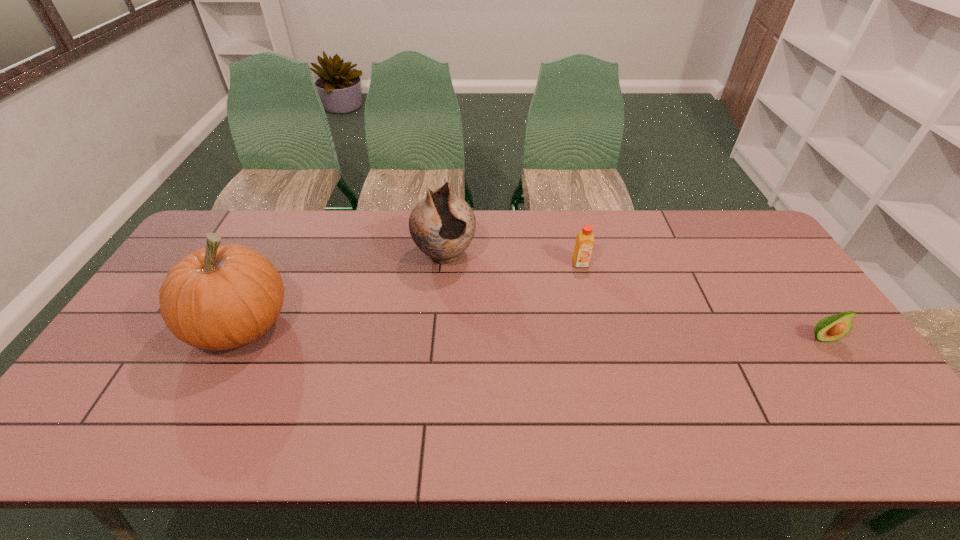
Where is `free spot located 0.260m on the front and back of the second shortest object`? The height and width of the screenshot is (540, 960). free spot located 0.260m on the front and back of the second shortest object is located at coordinates (601, 333).

The image size is (960, 540). In order to click on vacant space located 0.220m from the spout of the third object from right to left in this screenshot , I will do `click(482, 326)`.

The width and height of the screenshot is (960, 540). Find the location of `free spot located 0.220m from the spout of the third object from right to left`. free spot located 0.220m from the spout of the third object from right to left is located at coordinates (482, 326).

You are a GUI agent. You are given a task and a screenshot of the screen. Output one action in this format:
    pyautogui.click(x=<x>, y=<y>)
    Task: Click on the vacant point located 0.240m from the spout of the third object from right to left
    
    Given the screenshot: What is the action you would take?
    pyautogui.click(x=485, y=330)

At what (x,y) coordinates should I click in order to perform the action: click on object positioned at the far edge. Please return your answer as a coordinate pair (x, y). This screenshot has width=960, height=540. Looking at the image, I should click on (442, 225).

Find the location of a particular element. This screenshot has width=960, height=540. object at the left edge is located at coordinates point(221,297).

Locate an element on the screen. object located at the right edge is located at coordinates (831, 328).

Locate an element on the screen. The height and width of the screenshot is (540, 960). free region at the far edge of the desktop is located at coordinates (491, 248).

Where is `blank space at the near edge`? blank space at the near edge is located at coordinates (702, 409).

This screenshot has height=540, width=960. I want to click on vacant space at the left edge of the desktop, so click(x=142, y=323).